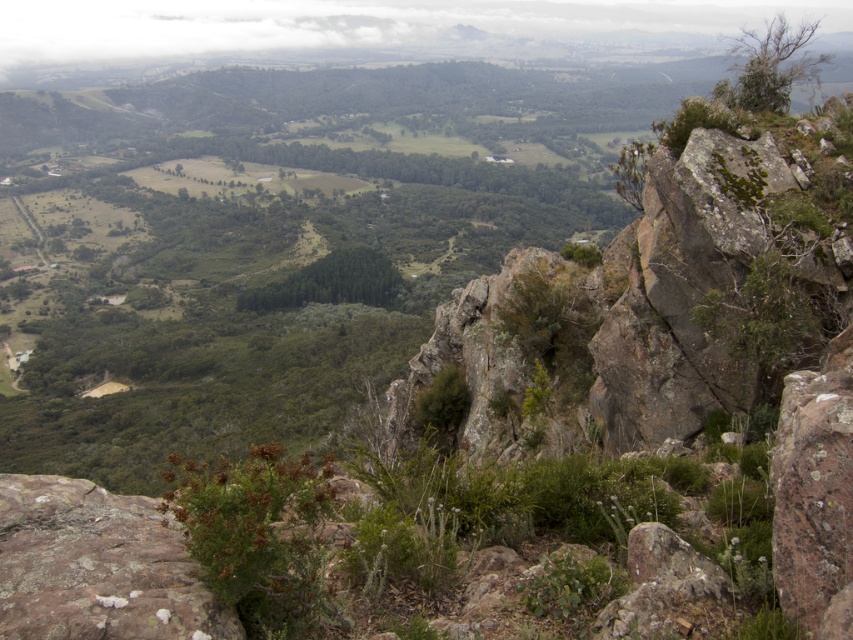
Question: Can you confirm if rusty rock at center is positioned above green leafy forest at center?

Choices:
 (A) no
 (B) yes

Answer: (A)

Question: Among these points, which one is farthest from the camera?

Choices:
 (A) (198, 602)
 (B) (705, 621)

Answer: (B)

Question: Can you confirm if rusty rock at lower left is positioned to the right of rusty rock at center?

Choices:
 (A) no
 (B) yes

Answer: (A)

Question: Which point is farther to the camera?

Choices:
 (A) (631, 609)
 (B) (138, 608)

Answer: (A)

Question: Can you confirm if rusty rock at center is positioned above green leafy forest at center?

Choices:
 (A) yes
 (B) no

Answer: (B)

Question: Which object is the closest to the rusty rock at lower left?

Choices:
 (A) rusty rock at center
 (B) green leafy forest at center

Answer: (A)